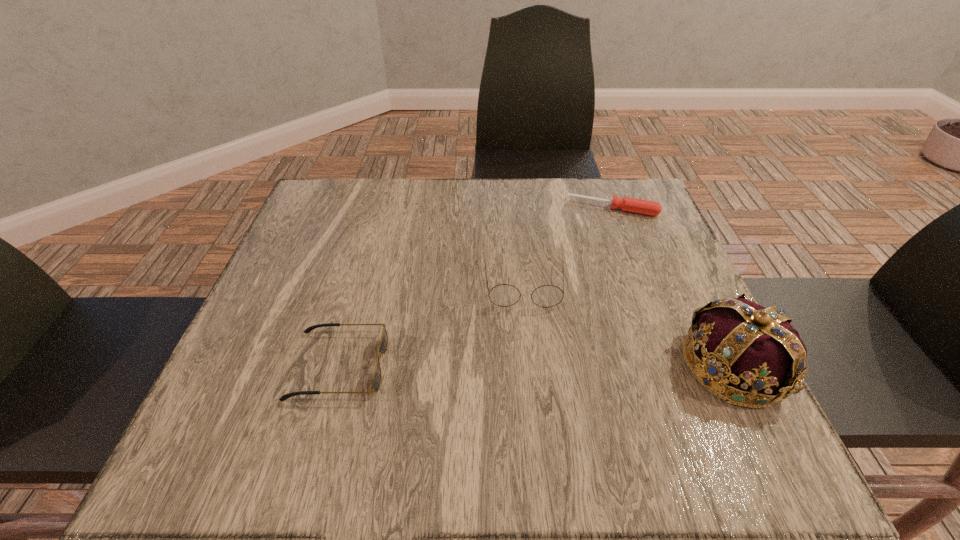
Locate an element on the screen. vacant space located 0.050m at the blade of the screwdriver is located at coordinates click(x=600, y=230).

Where is `vacant region located at the blade of the screwdriver`? This screenshot has height=540, width=960. vacant region located at the blade of the screwdriver is located at coordinates (591, 276).

You are a GUI agent. You are given a task and a screenshot of the screen. Output one action in this format:
    pyautogui.click(x=<x>, y=<y>)
    Task: Click on the blank space located 0.110m on the temples of the third nearest object
    The height and width of the screenshot is (540, 960).
    Given the screenshot: What is the action you would take?
    pyautogui.click(x=529, y=355)

The image size is (960, 540). Identify the location of vacant area situated on the temples of the third nearest object. click(x=531, y=394).

The width and height of the screenshot is (960, 540). Identify the location of blank space located on the temples of the third nearest object. tap(528, 346).

Where is `object that is at the far edge`? object that is at the far edge is located at coordinates (645, 207).

Find the location of `sunglasses present at the near edge`. sunglasses present at the near edge is located at coordinates (383, 346).

Find the location of a particular element. The width and height of the screenshot is (960, 540). crown present at the near edge is located at coordinates (751, 356).

What are the coordinates of `object that is positioned at the left edge` in the screenshot? It's located at (383, 346).

Find the location of a particular element. Image resolution: width=960 pixels, height=540 pixels. crown that is at the right edge is located at coordinates (751, 356).